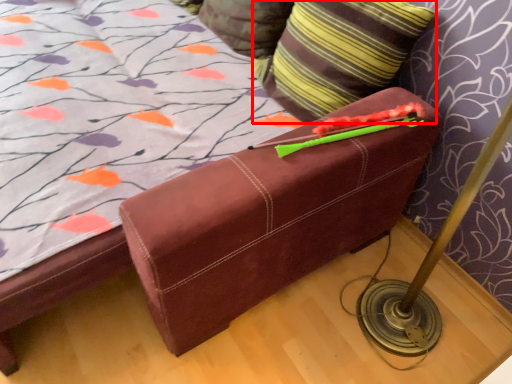
Question: Where is pillow (annotated by the red box) located in relation to pillow in the image?

Choices:
 (A) right
 (B) left

Answer: (A)